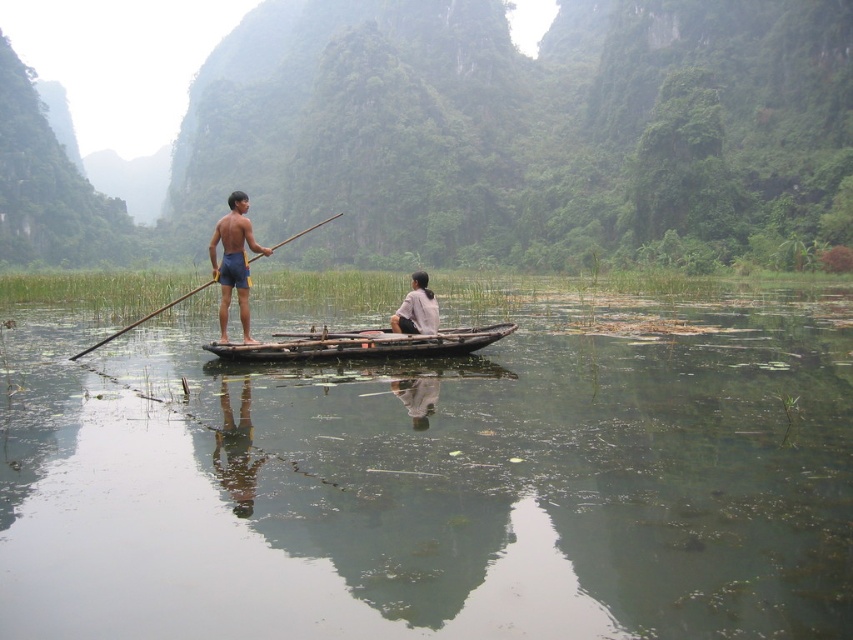
You are a photographer trying to capture a clear shot of the two people on the boat. You notice the matte blue shorts at center and the white matte shirt at center. Which clothing item appears larger in your photo?

The matte blue shorts at center appears larger in the photo because it is taller than the white matte shirt at center.